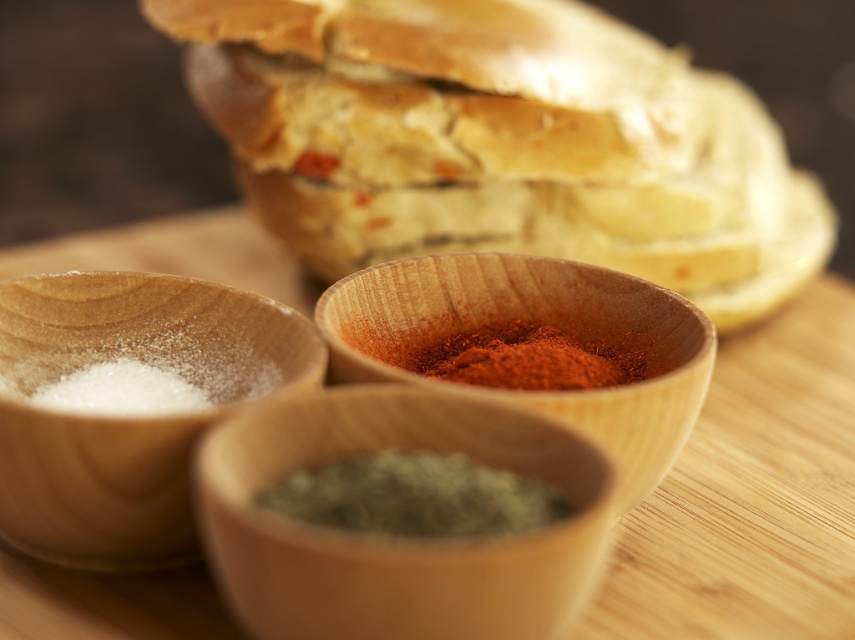
You are preparing a meal and need to choose between the green speckled wood spice at center and the red powder spice at center. Which spice container is wider?

The green speckled wood spice at center is wider than the red powder spice at center.

You are preparing a dish and need to identify the position of the green speckled wood spice at center and the green herb at center. Which one is located higher up?

The green herb at center is higher up because the green speckled wood spice at center is below it.